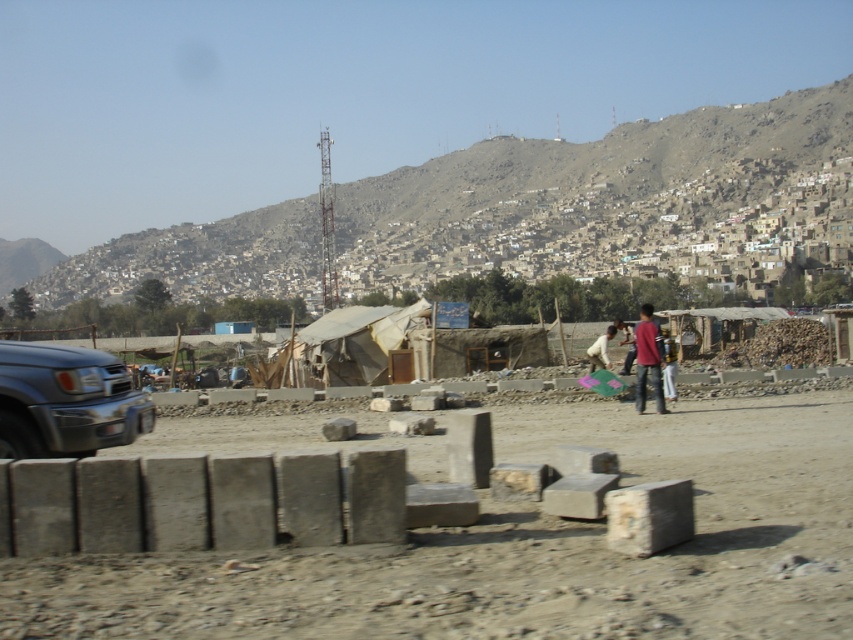
You are a construction worker who needs to transport gray concrete blocks at center to the red shirt at center. Given that your wheelbarrow can carry a maximum load of 200 kg and each block weighs 15 kg, how many trips will you need to make if you can carry as many blocks as possible each trip?

The distance between gray concrete blocks at center and red shirt at center is 12.67 meters. However, the number of trips depends on the number of blocks needed. Since the question doesn not specify how many blocks are required, it is impossible to determine the number of trips needed.

You are a construction worker in the rural area shown. You need to carry both the gray concrete blocks at center and the white cotton shirt at center. Which item requires a larger carrying space due to its size?

The gray concrete blocks at center requires a larger carrying space because its width is larger than the white cotton shirt at center.